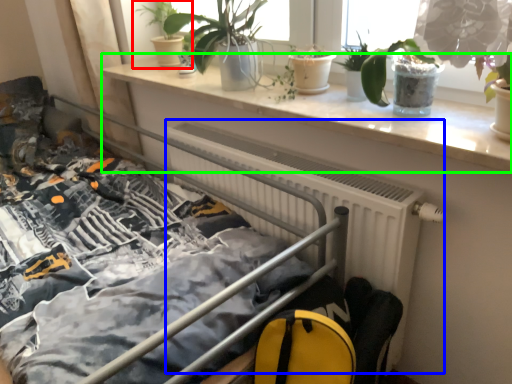
Question: Which is nearer to the houseplant (highlighted by a red box)? radiator (highlighted by a blue box) or window sill (highlighted by a green box).

Choices:
 (A) radiator
 (B) window sill

Answer: (B)